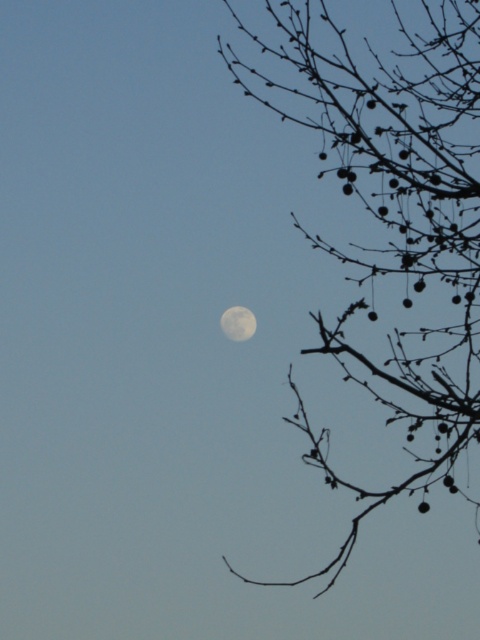
Does silvery bark branches at right have a smaller size compared to white matte moon at upper right?

Incorrect, silvery bark branches at right is not smaller in size than white matte moon at upper right.

Who is more distant from viewer, (x=435, y=61) or (x=241, y=332)?

The point (x=241, y=332) is more distant.

Is point (392, 77) farther from camera compared to point (228, 321)?

No.

Where is `silvery bark branches at right`? The height and width of the screenshot is (640, 480). silvery bark branches at right is located at coordinates (396, 220).